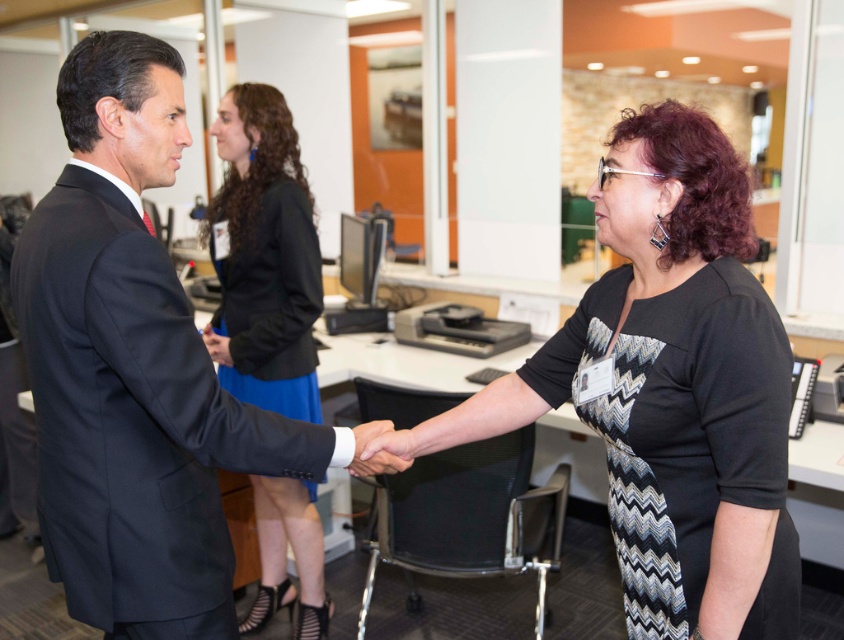
Looking at this image, you are a photographer setting up for a group photo. You need to position yourself so that both the shiny black suit at center and the blue satin skirt at center are in focus. Which object should you focus on first to ensure both are sharp?

You should focus on the shiny black suit at center first since it is closer to the viewer than the blue satin skirt at center. By focusing on the closer object, the depth of field will extend to include the farther object, ensuring both are in focus.

You are standing in the office and want to reach the point marked at coordinates (x=155, y=580). If you take a step forward of 0.5 meters, will you be closer to that point?

The distance between you and the point is 1.37 meters. After stepping forward 0.5 meters, you will be 0.87 meters away, so yes, you will be closer.